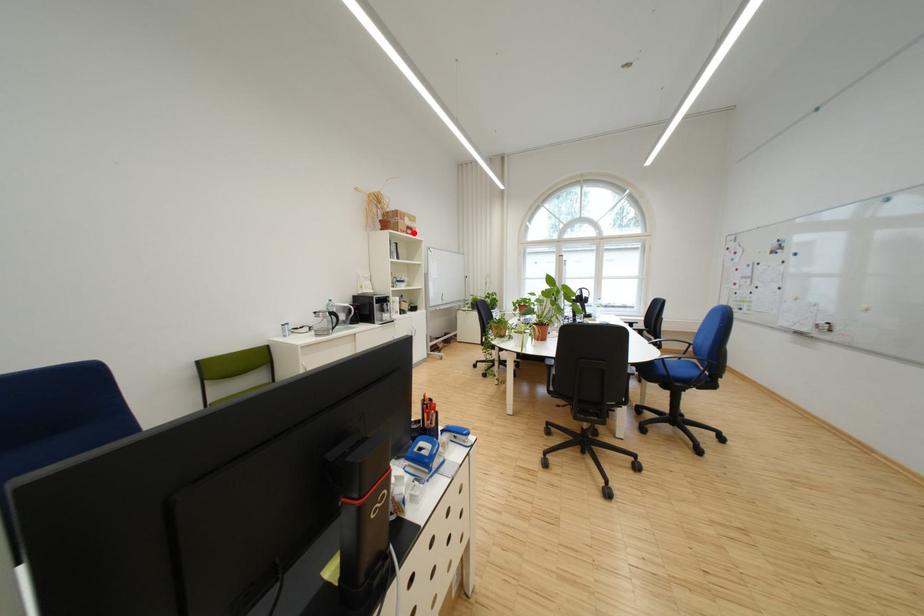
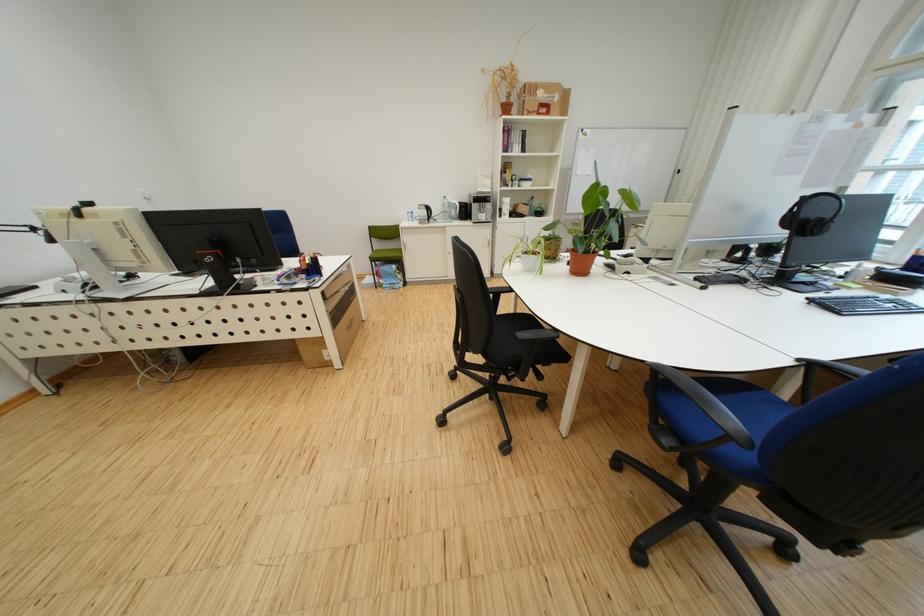
The point at the highlighted location is marked in the first image. Where is the corresponding point in the second image?

(541, 115)